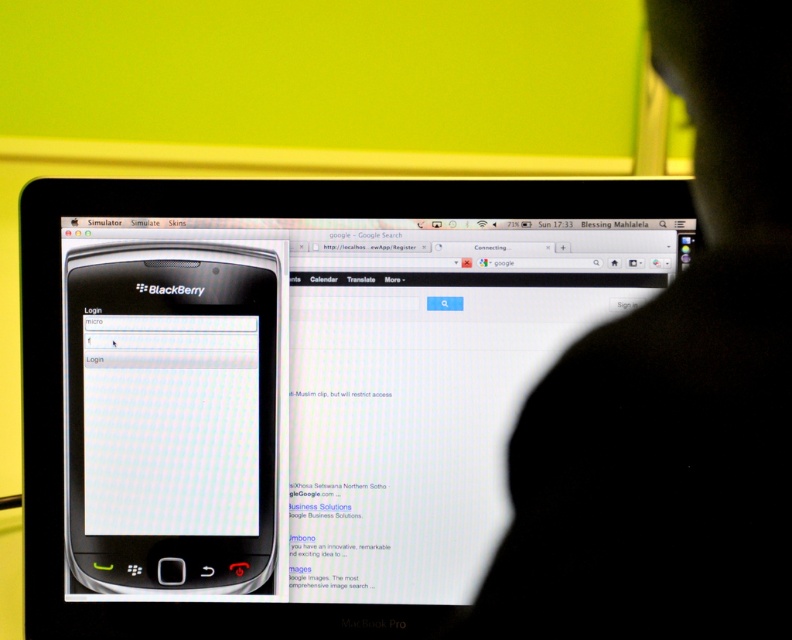
Does black matte silhouette at center appear over white glossy blackberry at center-left?

Yes, black matte silhouette at center is above white glossy blackberry at center-left.

I want to click on black matte silhouette at center, so click(672, 392).

This screenshot has height=640, width=792. In order to click on black matte silhouette at center in this screenshot , I will do `click(672, 392)`.